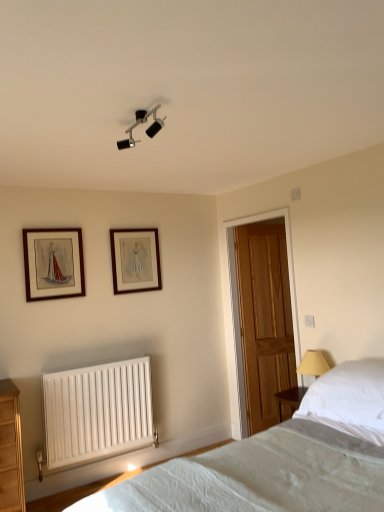
Find the location of a particular element. The image size is (384, 512). white fabric bed at lower right is located at coordinates (260, 475).

I want to click on wooden door at center, so click(266, 313).

What do you see at coordinates (97, 412) in the screenshot? I see `white matte radiator at lower left` at bounding box center [97, 412].

The image size is (384, 512). What do you see at coordinates (53, 263) in the screenshot?
I see `wooden framed picture at upper left, which is the first picture frame in front-to-back order` at bounding box center [53, 263].

Locate an element on the screen. The image size is (384, 512). white fabric bed at lower right is located at coordinates (260, 475).

From the image's perspective, would you say white soft pillow at right is positioned over wooden door at center?

No, from the image's perspective, white soft pillow at right is not above wooden door at center.

Looking at this image, is white soft pillow at right inside the boundaries of wooden door at center, or outside?

white soft pillow at right lies outside wooden door at center.

Which of these two, white soft pillow at right or wooden door at center, stands shorter?

Standing shorter between the two is white soft pillow at right.

Based on their sizes in the image, would you say wooden picture frame at upper center, which appears as the 1th picture frame when viewed from the back, is bigger or smaller than white matte radiator at lower left?

Considering their sizes, wooden picture frame at upper center, which appears as the 1th picture frame when viewed from the back, takes up less space than white matte radiator at lower left.

How different are the orientations of wooden picture frame at upper center, placed as the second picture frame when sorted from front to back, and white matte radiator at lower left in degrees?

There is a 0.872-degree angle between the facing directions of wooden picture frame at upper center, placed as the second picture frame when sorted from front to back, and white matte radiator at lower left.

From the image's perspective, is wooden picture frame at upper center, which appears as the 1th picture frame when viewed from the back, located above or below white matte radiator at lower left?

wooden picture frame at upper center, which appears as the 1th picture frame when viewed from the back, is above white matte radiator at lower left.

Is wooden picture frame at upper center, which is the second picture frame in left-to-right order, oriented away from white matte radiator at lower left?

No, wooden picture frame at upper center, which is the second picture frame in left-to-right order, is not facing away from white matte radiator at lower left.

Does matte black light fixture at upper center have a greater height compared to white matte radiator at lower left?

Incorrect, the height of matte black light fixture at upper center is not larger of that of white matte radiator at lower left.

The height and width of the screenshot is (512, 384). Identify the location of light fixture on the right side of white matte radiator at lower left. (142, 123).

Is matte black light fixture at upper center inside the boundaries of white matte radiator at lower left, or outside?

matte black light fixture at upper center is spatially situated outside white matte radiator at lower left.

Consider the image. From a real-world perspective, is matte black light fixture at upper center physically located above or below white matte radiator at lower left?

From a real-world perspective, matte black light fixture at upper center is physically above white matte radiator at lower left.

Which of these two, wooden door at center or wooden picture frame at upper center, which appears as the 1th picture frame when viewed from the back, is smaller?

wooden picture frame at upper center, which appears as the 1th picture frame when viewed from the back, is smaller.

From the picture: Is wooden door at center facing away from wooden picture frame at upper center, placed as the second picture frame when sorted from front to back?

That's not correct — wooden door at center is not looking away from wooden picture frame at upper center, placed as the second picture frame when sorted from front to back.

From a real-world perspective, is wooden door at center located beneath wooden picture frame at upper center, which is the second picture frame in left-to-right order?

Correct, in the physical world, wooden door at center is lower than wooden picture frame at upper center, which is the second picture frame in left-to-right order.

Which object is positioned more to the left, matte black light fixture at upper center or white soft pillow at right?

matte black light fixture at upper center.

What's the angular difference between matte black light fixture at upper center and white soft pillow at right's facing directions?

There is a 5.61-degree angle between the facing directions of matte black light fixture at upper center and white soft pillow at right.

Based on the photo, is matte black light fixture at upper center facing away from white soft pillow at right?

No, matte black light fixture at upper center is not facing the opposite direction of white soft pillow at right.

From the image's perspective, is white matte radiator at lower left on top of white soft pillow at right?

No, from the image's perspective, white matte radiator at lower left is not above white soft pillow at right.

Is point (129, 410) positioned after point (334, 384)?

Yes, it is.

The image size is (384, 512). Find the location of `pillow above the white matte radiator at lower left (from the image's perspective)`. pillow above the white matte radiator at lower left (from the image's perspective) is located at coordinates (349, 394).

From a real-world perspective, which is physically above, wooden door at center or white soft pillow at right?

wooden door at center is physically above.

Could white soft pillow at right be considered to be inside wooden door at center?

That's incorrect, white soft pillow at right is not inside wooden door at center.

The height and width of the screenshot is (512, 384). Identify the location of pillow to the right of wooden door at center. (349, 394).

Identify the location of door behind the white soft pillow at right. (266, 313).

Where is `radiator that is below the wooden picture frame at upper center, which appears as the 1th picture frame when viewed from the back (from the image's perspective)`? This screenshot has width=384, height=512. radiator that is below the wooden picture frame at upper center, which appears as the 1th picture frame when viewed from the back (from the image's perspective) is located at coordinates (97, 412).

When comparing their distances from wooden picture frame at upper center, which is the second picture frame in left-to-right order, does wooden framed picture at upper left, the 1th picture frame when ordered from left to right, or white soft pillow at right seem closer?

wooden framed picture at upper left, the 1th picture frame when ordered from left to right, lies closer to wooden picture frame at upper center, which is the second picture frame in left-to-right order, than the other object.

Based on their spatial positions, is white soft pillow at right or wooden door at center further from white fabric bed at lower right?

wooden door at center.

From the image, which object appears to be nearer to white soft pillow at right, white matte radiator at lower left or wooden door at center?

wooden door at center.

When comparing their distances from wooden picture frame at upper center, placed as the second picture frame when sorted from front to back, does wooden door at center or white soft pillow at right seem further?

white soft pillow at right is further to wooden picture frame at upper center, placed as the second picture frame when sorted from front to back.

In the scene shown: Estimate the real-world distances between objects in this image. Which object is further from wooden picture frame at upper center, which is the second picture frame in left-to-right order, white matte radiator at lower left or matte black light fixture at upper center?

Among the two, matte black light fixture at upper center is located further to wooden picture frame at upper center, which is the second picture frame in left-to-right order.

Based on their spatial positions, is white fabric bed at lower right or white soft pillow at right further from wooden door at center?

Based on the image, white fabric bed at lower right appears to be further to wooden door at center.

Which object lies further to the anchor point wooden picture frame at upper center, which is the second picture frame in left-to-right order, wooden framed picture at upper left, the 1th picture frame when ordered from left to right, or white fabric bed at lower right?

The object further to wooden picture frame at upper center, which is the second picture frame in left-to-right order, is white fabric bed at lower right.

Based on their spatial positions, is wooden door at center or white matte radiator at lower left further from wooden picture frame at upper center, which is the second picture frame in left-to-right order?

wooden door at center is further to wooden picture frame at upper center, which is the second picture frame in left-to-right order.

Identify the location of picture frame situated between wooden framed picture at upper left, which is the first picture frame in front-to-back order, and wooden door at center from left to right. This screenshot has height=512, width=384. (135, 260).

Identify the location of radiator positioned between white soft pillow at right and wooden door at center from near to far. Image resolution: width=384 pixels, height=512 pixels. (97, 412).

Locate an element on the screen. This screenshot has height=512, width=384. light fixture between white fabric bed at lower right and white matte radiator at lower left from front to back is located at coordinates [142, 123].

You are a GUI agent. You are given a task and a screenshot of the screen. Output one action in this format:
    pyautogui.click(x=<x>, y=<y>)
    Task: Click on the radiator between wooden framed picture at upper left, which is the first picture frame in front-to-back order, and wooden door at center from left to right
    
    Given the screenshot: What is the action you would take?
    pyautogui.click(x=97, y=412)